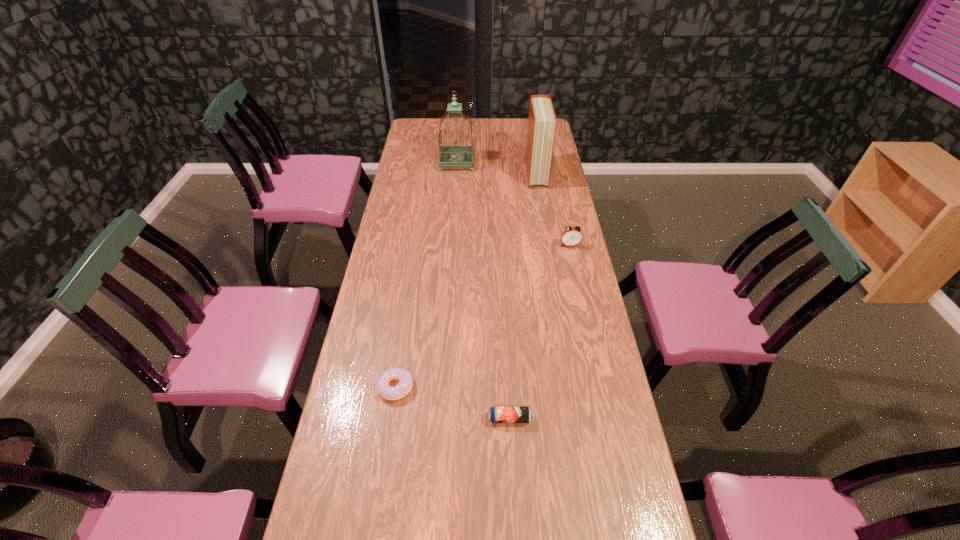
Identify the location of vacant area that lies between the fourth farthest object and the beer can. The width and height of the screenshot is (960, 540). (452, 403).

At what (x,y) coordinates should I click in order to perform the action: click on free space between the third nearest object and the doughnut. Please return your answer as a coordinate pair (x, y). Looking at the image, I should click on (483, 316).

You are a GUI agent. You are given a task and a screenshot of the screen. Output one action in this format:
    pyautogui.click(x=<x>, y=<y>)
    Task: Click on the unoccupied area between the third object from right to left and the hardback book
    This screenshot has height=540, width=960.
    Given the screenshot: What is the action you would take?
    tap(523, 296)

You are a GUI agent. You are given a task and a screenshot of the screen. Output one action in this format:
    pyautogui.click(x=<x>, y=<y>)
    Task: Click on the free space between the third object from right to left and the birdcage
    Image resolution: width=960 pixels, height=540 pixels.
    Given the screenshot: What is the action you would take?
    pyautogui.click(x=483, y=291)

Find the location of a particular element. This screenshot has height=540, width=960. empty space that is in between the third tallest object and the birdcage is located at coordinates (514, 204).

You are a GUI agent. You are given a task and a screenshot of the screen. Output one action in this format:
    pyautogui.click(x=<x>, y=<y>)
    Task: Click on the free point between the third shortest object and the birdcage
    The image size is (960, 540).
    Given the screenshot: What is the action you would take?
    pyautogui.click(x=514, y=204)

At what (x,y) coordinates should I click in order to perform the action: click on unoccupied area between the birdcage and the doughnut. Please return your answer as a coordinate pair (x, y). Looking at the image, I should click on (426, 275).

Identify which object is the second nearest to the third shortest object. Please provide its 2D coordinates. Your answer should be formatted as a tuple, i.e. [(x, y)], where the tuple contains the x and y coordinates of a point satisfying the conditions above.

[(451, 155)]

This screenshot has width=960, height=540. I want to click on object that stands as the third closest to the beer can, so click(x=542, y=121).

At what (x,y) coordinates should I click in order to perform the action: click on vacant position in the image that satisfies the following two spatial constraints: 1. at the door of the birdcage; 2. on the left side of the nearest object. Please return your answer as a coordinate pair (x, y). This screenshot has width=960, height=540. Looking at the image, I should click on (439, 419).